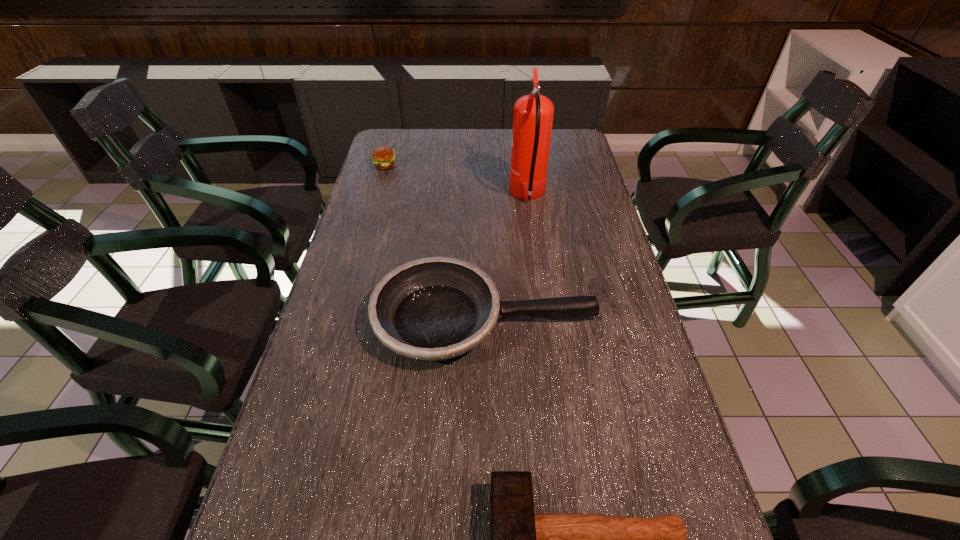
Image resolution: width=960 pixels, height=540 pixels. Identify the location of object that is at the far edge. (383, 157).

Identify the location of frying pan that is at the left edge. (433, 309).

Identify the location of hamburger at the left edge. (383, 157).

This screenshot has width=960, height=540. What are the coordinates of `object at the right edge` in the screenshot? It's located at (433, 309).

At what (x,y) coordinates should I click in order to perform the action: click on object situated at the far left corner. Please return your answer as a coordinate pair (x, y). The height and width of the screenshot is (540, 960). Looking at the image, I should click on (383, 157).

The width and height of the screenshot is (960, 540). What are the coordinates of `vacant space at the far edge of the desktop` in the screenshot? It's located at (464, 134).

Find the location of `vacant space at the left edge of the desktop`. vacant space at the left edge of the desktop is located at coordinates (392, 181).

Identify the location of vacant space at the right edge of the desktop. The width and height of the screenshot is (960, 540). (607, 219).

You are a GUI agent. You are given a task and a screenshot of the screen. Output one action in this format:
    pyautogui.click(x=<x>, y=<y>)
    Task: Click on the vacant space at the far left corner
    
    Given the screenshot: What is the action you would take?
    pyautogui.click(x=415, y=140)

Where is `vacant region at the far right corner`? This screenshot has width=960, height=540. vacant region at the far right corner is located at coordinates (563, 128).